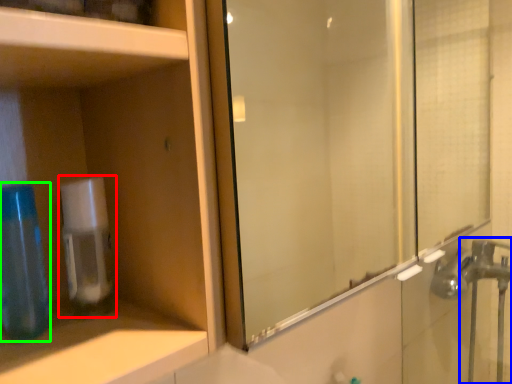
Question: Estimate the real-world distances between objects in this image. Which object is closer to soap dispenser (highlighted by a red box), faucet (highlighted by a blue box) or mouthwash (highlighted by a green box)?

Choices:
 (A) faucet
 (B) mouthwash

Answer: (B)